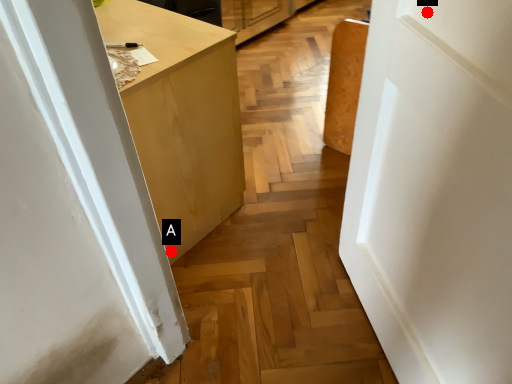
Question: Two points are circled on the image, labeled by A and B beside each circle. Which point appears closest to the camera in this image?

Choices:
 (A) A is closer
 (B) B is closer

Answer: (B)